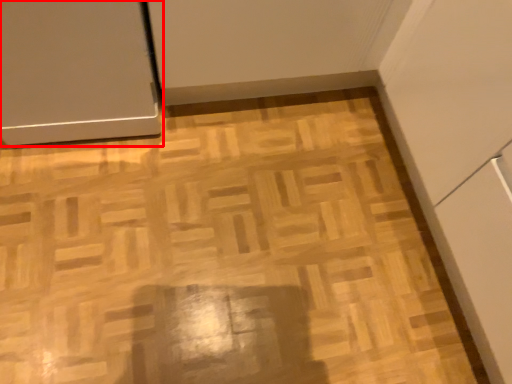
Question: From the image's perspective, what is the correct spatial positioning of door (annotated by the red box) in reference to plywood?

Choices:
 (A) below
 (B) above

Answer: (B)